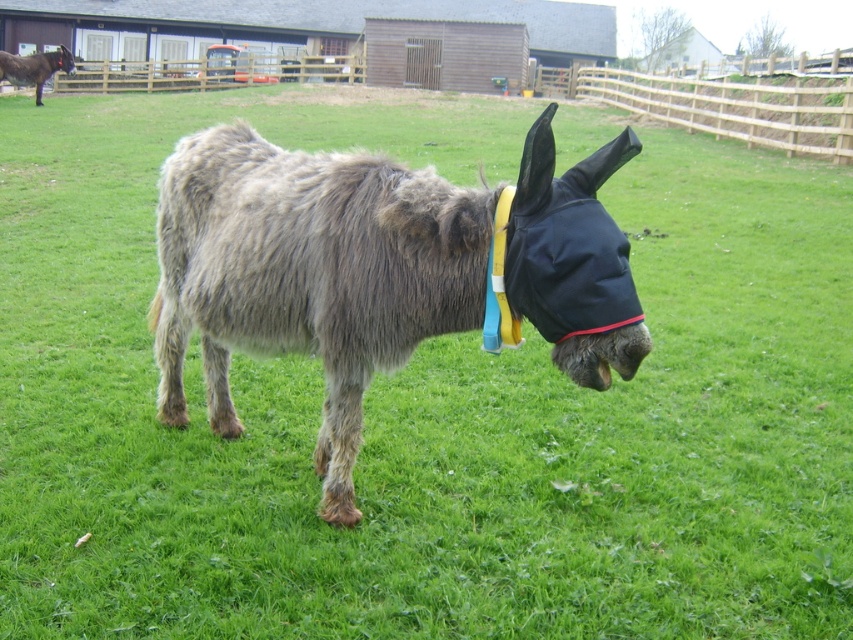
Is fuzzy gray donkey at center below brown fuzzy mule at upper left?

Indeed, fuzzy gray donkey at center is positioned under brown fuzzy mule at upper left.

Which is behind, point (457, 234) or point (26, 68)?

Point (26, 68)

Identify the location of fuzzy gray donkey at center. Image resolution: width=853 pixels, height=640 pixels. (309, 275).